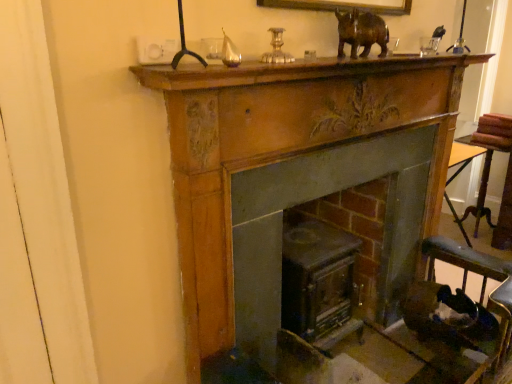
Question: Does smooth dark wood fireplace at center, placed as the 1th fireplace when sorted from left to right, lie behind brown polished wood rhino at upper center?

Choices:
 (A) yes
 (B) no

Answer: (A)

Question: Can you confirm if smooth dark wood fireplace at center, placed as the second fireplace when sorted from right to left, is shorter than brown polished wood rhino at upper center?

Choices:
 (A) yes
 (B) no

Answer: (B)

Question: Is smooth dark wood fireplace at center, placed as the 1th fireplace when sorted from left to right, touching brown polished wood rhino at upper center?

Choices:
 (A) yes
 (B) no

Answer: (B)

Question: From a real-world perspective, is smooth dark wood fireplace at center, placed as the 1th fireplace when sorted from left to right, on top of brown polished wood rhino at upper center?

Choices:
 (A) no
 (B) yes

Answer: (A)

Question: Is smooth dark wood fireplace at center, placed as the second fireplace when sorted from right to left, positioned in front of brown polished wood rhino at upper center?

Choices:
 (A) yes
 (B) no

Answer: (B)

Question: Is point (426, 331) closer or farther from the camera than point (352, 19)?

Choices:
 (A) farther
 (B) closer

Answer: (A)

Question: From a real-world perspective, is dark brown leather rocking chair at lower right physically located above or below brown polished wood rhino at upper center?

Choices:
 (A) above
 (B) below

Answer: (B)

Question: In terms of size, does dark brown leather rocking chair at lower right appear bigger or smaller than brown polished wood rhino at upper center?

Choices:
 (A) small
 (B) big

Answer: (B)

Question: In the image, is dark brown leather rocking chair at lower right on the left side or the right side of brown polished wood rhino at upper center?

Choices:
 (A) right
 (B) left

Answer: (A)

Question: In the image, is brown polished wood rhino at upper center positioned in front of or behind wooden table at right?

Choices:
 (A) behind
 (B) front

Answer: (B)

Question: Considering the positions of brown polished wood rhino at upper center and wooden table at right in the image, is brown polished wood rhino at upper center bigger or smaller than wooden table at right?

Choices:
 (A) small
 (B) big

Answer: (A)

Question: From a real-world perspective, is brown polished wood rhino at upper center physically located above or below wooden table at right?

Choices:
 (A) below
 (B) above

Answer: (B)

Question: Looking at their shapes, would you say brown polished wood rhino at upper center is wider or thinner than wooden table at right?

Choices:
 (A) wide
 (B) thin

Answer: (B)

Question: Based on their positions, is smooth dark wood fireplace at center, placed as the second fireplace when sorted from right to left, located to the left or right of dark brown leather rocking chair at lower right?

Choices:
 (A) right
 (B) left

Answer: (B)

Question: Does point (233, 258) appear closer or farther from the camera than point (504, 329)?

Choices:
 (A) farther
 (B) closer

Answer: (B)